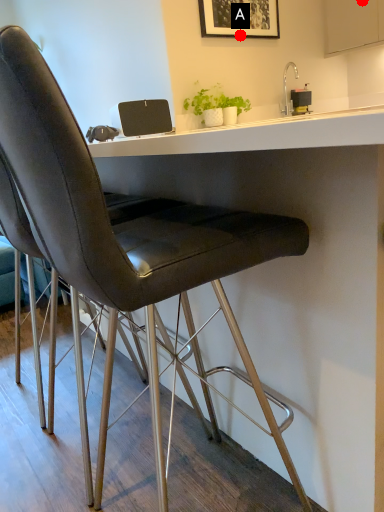
Question: Two points are circled on the image, labeled by A and B beside each circle. Which of the following is the farthest from the observer?

Choices:
 (A) A is further
 (B) B is further

Answer: (B)